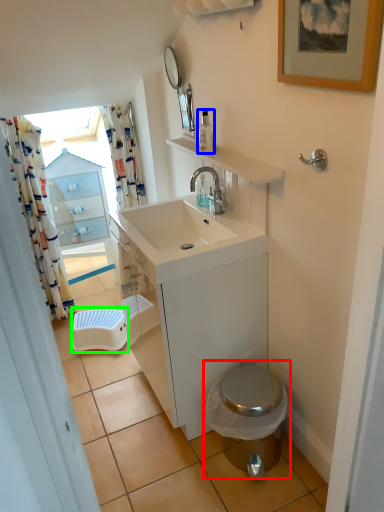
Question: Which is farther away from toilet (highlighted by a red box)? soap dispenser (highlighted by a blue box) or step stool (highlighted by a green box)?

Choices:
 (A) soap dispenser
 (B) step stool

Answer: (A)